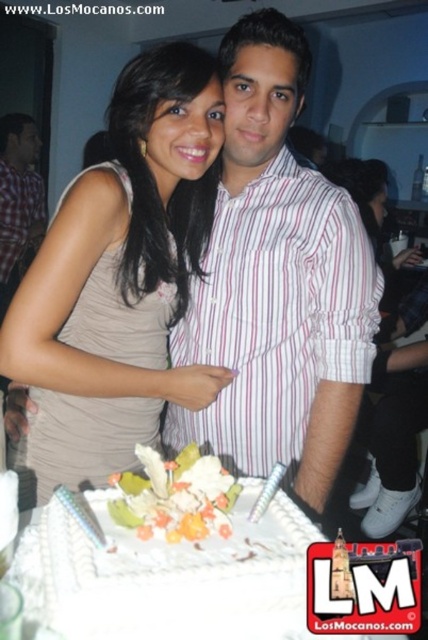
You are a photographer trying to capture the perfect shot of the matte beige dress at center. The camera you are using has a focus point at coordinate point [121,275]. Will this focus point help you capture the dress clearly?

Yes, the matte beige dress at center is located at point [121,275], so the focus point will directly align with the dress, ensuring it is in clear focus.

You are planning to place a 10 feet long banner between the pink striped shirt at center and the checkered fabric shirt at left. Will the banner fit between them?

The distance between the pink striped shirt at center and the checkered fabric shirt at left is 8.80 feet. Since the banner is 10 feet long, it is longer than the available space, so the banner will not fit between them.

You are standing at the origin of the coordinate system. There are two points in the scene, point (240, 49) and point (100, 566). Which point is closer to you?

Point (100, 566) is closer to you because it is in front of point (240, 49).